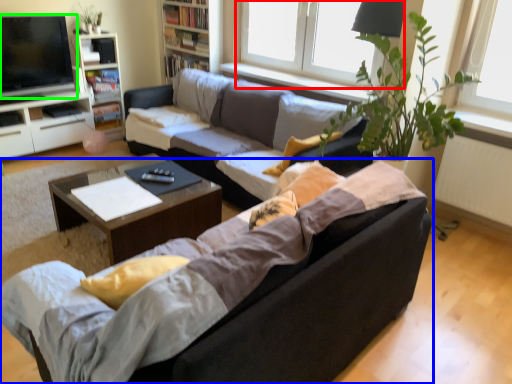
Question: Considering the real-world distances, which object is farthest from window (highlighted by a red box)? studio couch (highlighted by a blue box) or television (highlighted by a green box)?

Choices:
 (A) studio couch
 (B) television

Answer: (A)